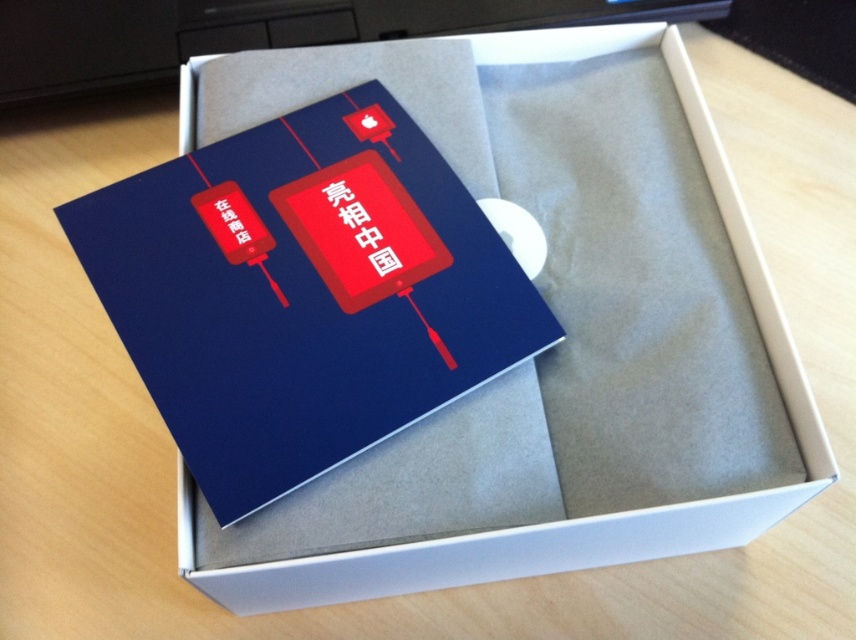
You are an assistant who needs to place a new item on the table. The table has a coordinate system where the bottom left corner is the origin point. The blue cardboard box at center is located at point (556, 346). If you want to place the new item to the right of the blue cardboard box at center, what coordinate should you choose?

To place the new item to the right of the blue cardboard box at center located at point (556, 346), you should choose a coordinate with an x value greater than 0.542 and the same y value. For example, 0.6, 0.650 would be to the right.

You are organizing a display for a product launch event. You have a blue cardboard box at center and a matte blue card at center. Which object should you place first if you want to ensure the larger item is at the bottom for stability?

You should place the blue cardboard box at center first because it is larger than the matte blue card at center, providing a stable base.

You are organizing items on a desk and need to place both the blue cardboard box at center and the matte blue card at center. If you want to arrange them side by side horizontally without overlapping, which object should be placed first to the left to ensure they fit within the desk space?

The blue cardboard box at center has a larger width than the matte blue card at center, so placing the blue cardboard box at center first to the left will ensure there is enough space for both items when arranged side by side horizontally.